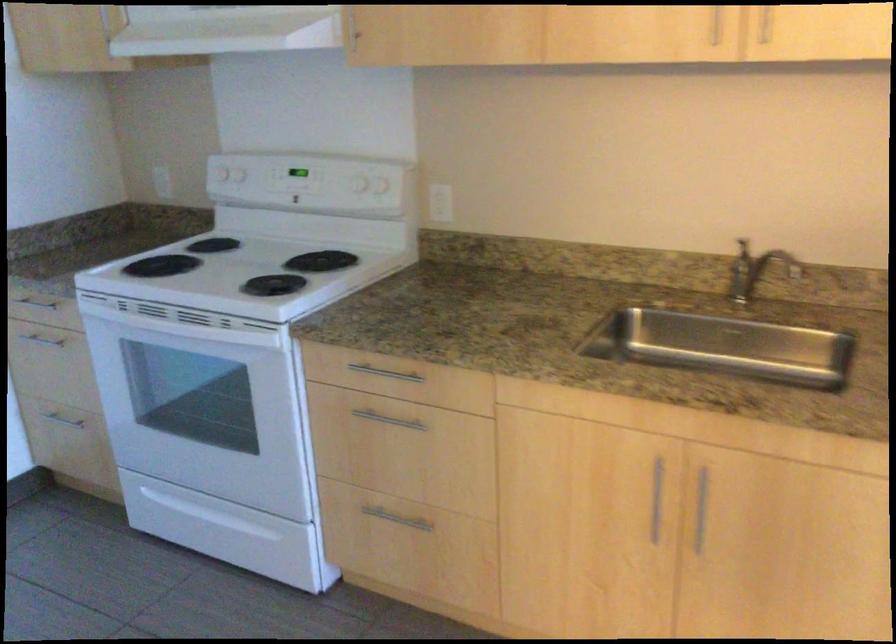
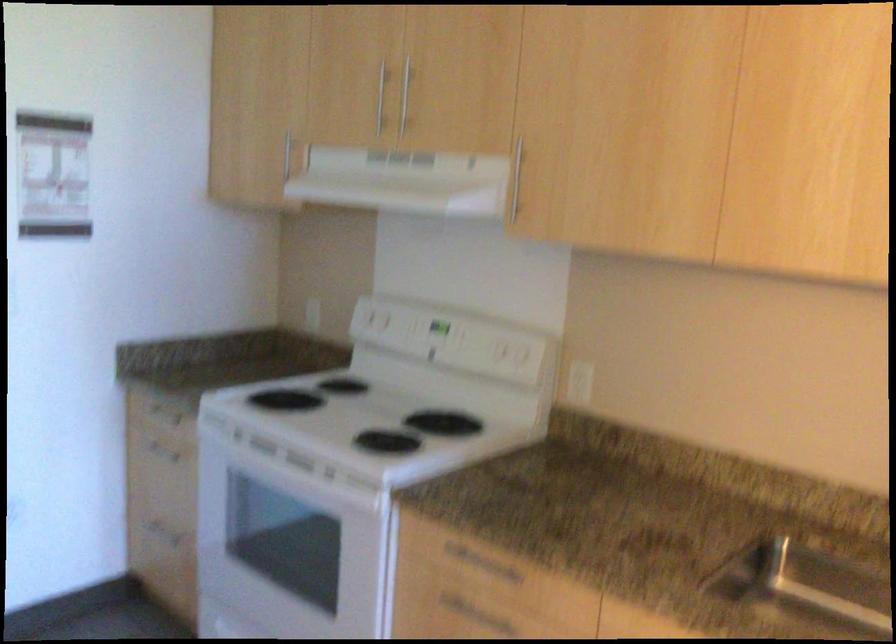
Where in the second image is the point corresponding to (x=382, y=373) from the first image?

(480, 564)